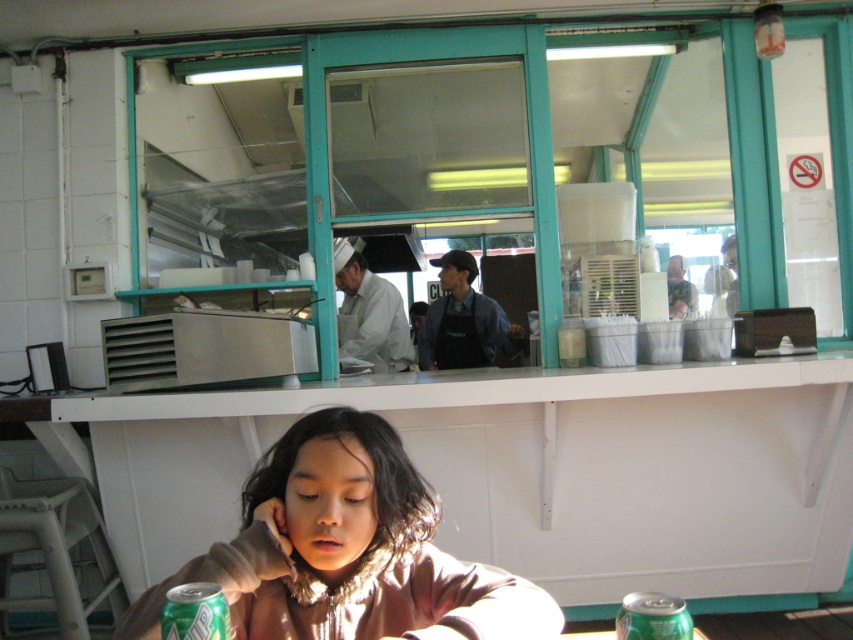
This screenshot has height=640, width=853. What do you see at coordinates (194, 612) in the screenshot?
I see `green matte can at lower left` at bounding box center [194, 612].

Does green matte can at lower left appear over green matte can at lower right?

Correct, green matte can at lower left is located above green matte can at lower right.

What do you see at coordinates (194, 612) in the screenshot? This screenshot has width=853, height=640. I see `green matte can at lower left` at bounding box center [194, 612].

This screenshot has width=853, height=640. I want to click on green matte can at lower left, so click(194, 612).

Can you confirm if white plastic stool at lower left is taller than green matte can at lower right?

Indeed, white plastic stool at lower left has a greater height compared to green matte can at lower right.

Between white plastic stool at lower left and green matte can at lower right, which one appears on the left side from the viewer's perspective?

white plastic stool at lower left

Which is in front, point (61, 564) or point (664, 625)?

Point (664, 625) is in front.

Find the location of a particular element. white plastic stool at lower left is located at coordinates (54, 547).

Can you confirm if white matte table at lower center is positioned to the left of white plastic stool at lower left?

No, white matte table at lower center is not to the left of white plastic stool at lower left.

Is white matte table at lower center above white plastic stool at lower left?

Yes.

Who is more forward, (x=165, y=449) or (x=53, y=596)?

Point (x=53, y=596) is more forward.

Find the location of a particular element. The image size is (853, 640). white matte table at lower center is located at coordinates (534, 472).